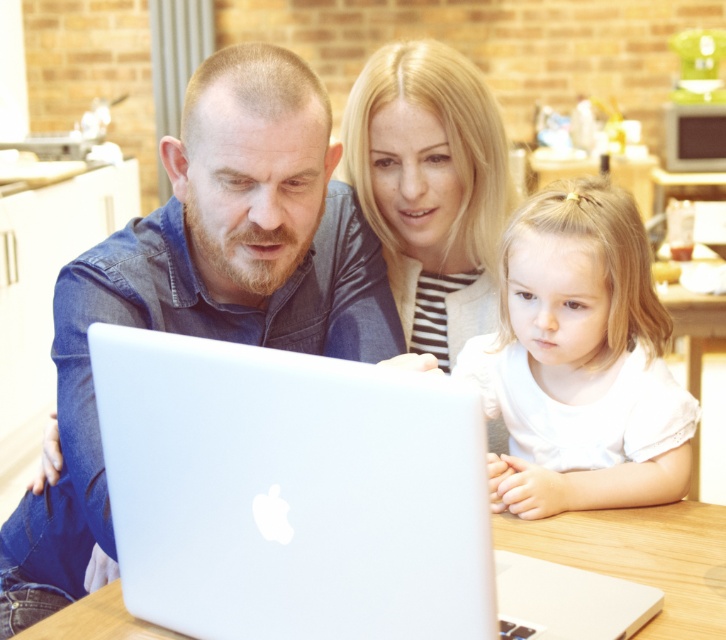
You are a delivery person who needs to place a small package on the table. The package is 10 inches long. Can you fit it between the white matte shirt at lower right and the white wooden table at center without moving the shirt?

The distance between the white matte shirt at lower right and the white wooden table at center is 8.52 inches, which is shorter than the package length of 10 inches. Therefore, the package cannot be placed there without moving the shirt.

Based on the photo, you are a photographer trying to capture a closeup of the white matte shirt at lower right. Based on the scene, where should you position your camera to get the best shot?

The white matte shirt at lower right is located at point 0.566 on the x axis and 0.800 on the y axis, so to capture a closeup, position the camera directly facing the coordinates to ensure the subject is centered in the frame.